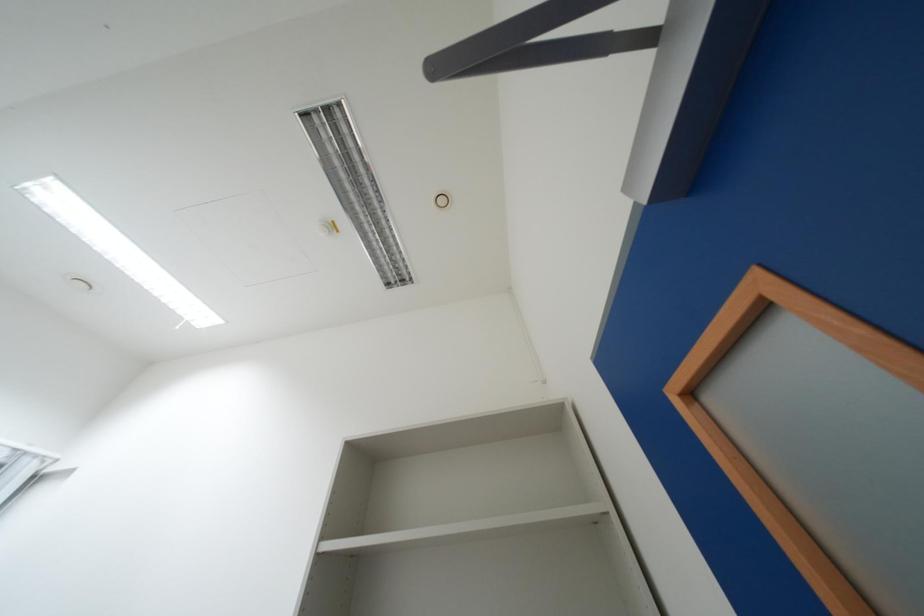
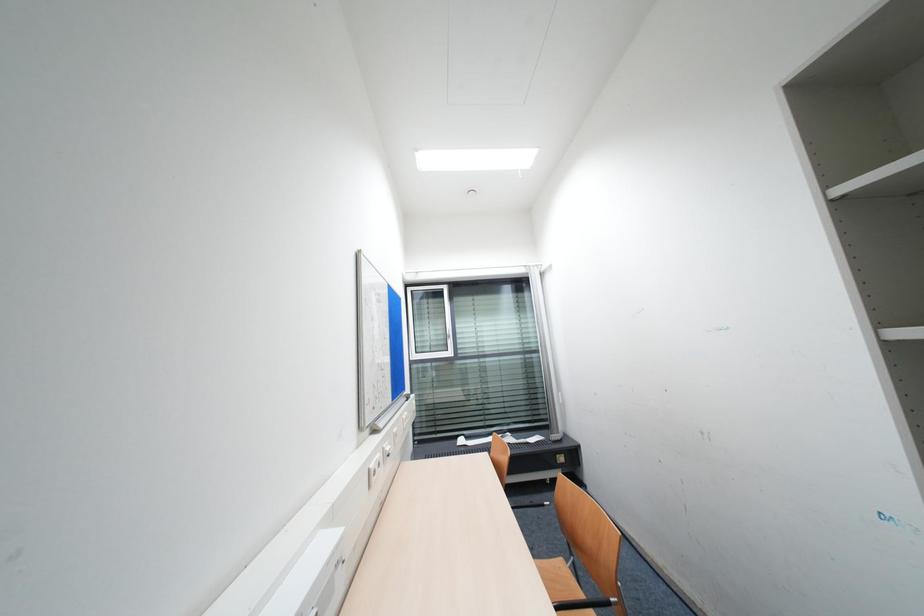
Question: The camera is either moving clockwise (left) or counter-clockwise (right) around the object. The first image is from the beginning of the video and the second image is from the end. Is the camera moving left or right when shooting the video?

Choices:
 (A) Left
 (B) Right

Answer: (B)